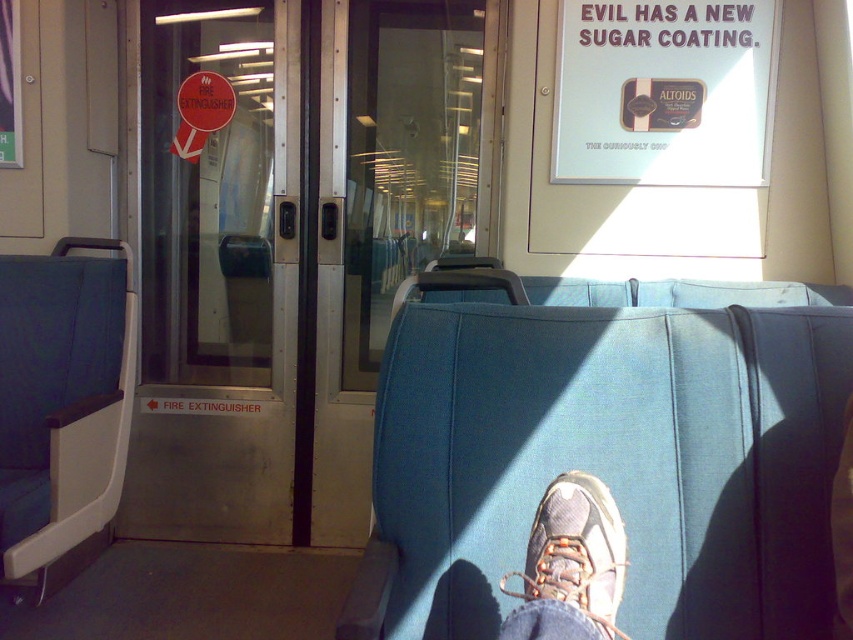
Question: Can you confirm if blue fabric seat at center is thinner than camouflage fabric sneaker at lower center?

Choices:
 (A) yes
 (B) no

Answer: (B)

Question: Does blue fabric seat at center have a larger size compared to camouflage fabric sneaker at lower center?

Choices:
 (A) no
 (B) yes

Answer: (B)

Question: Can you confirm if blue fabric seat at center is smaller than camouflage fabric sneaker at lower center?

Choices:
 (A) no
 (B) yes

Answer: (A)

Question: Which point appears closest to the camera in this image?

Choices:
 (A) (680, 500)
 (B) (527, 547)

Answer: (B)